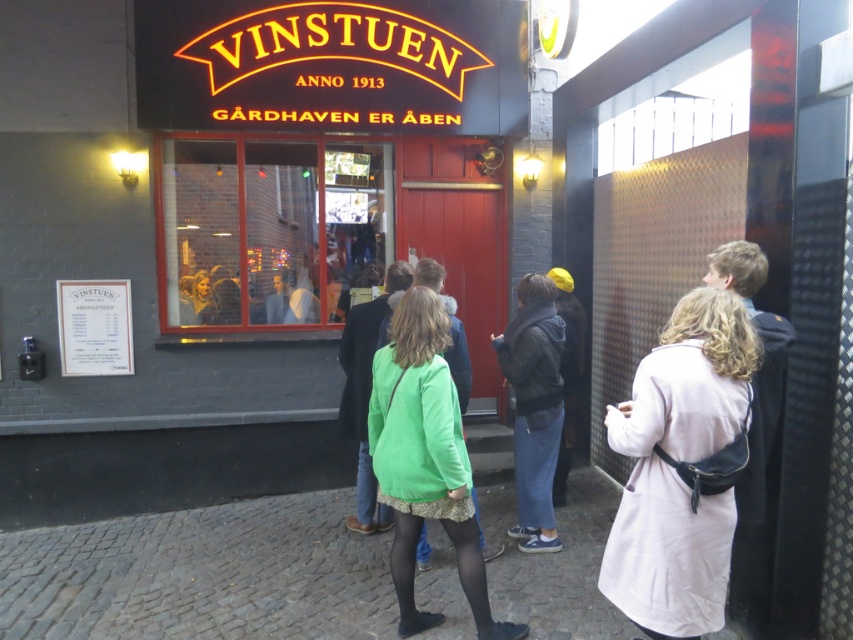
You are standing at the entrance of VINSTUEN and want to approach the light beige coat at center. What are the coordinates you should move towards?

The coordinates you should move towards are (676,470) as the light beige coat at center is located there.

Consider the image. You are trying to decide which coat to wear to the event at VINSTUEN. You have a light beige coat at center and a denim jacket at center. Which one is wider?

The light beige coat at center is wider than the denim jacket at center.